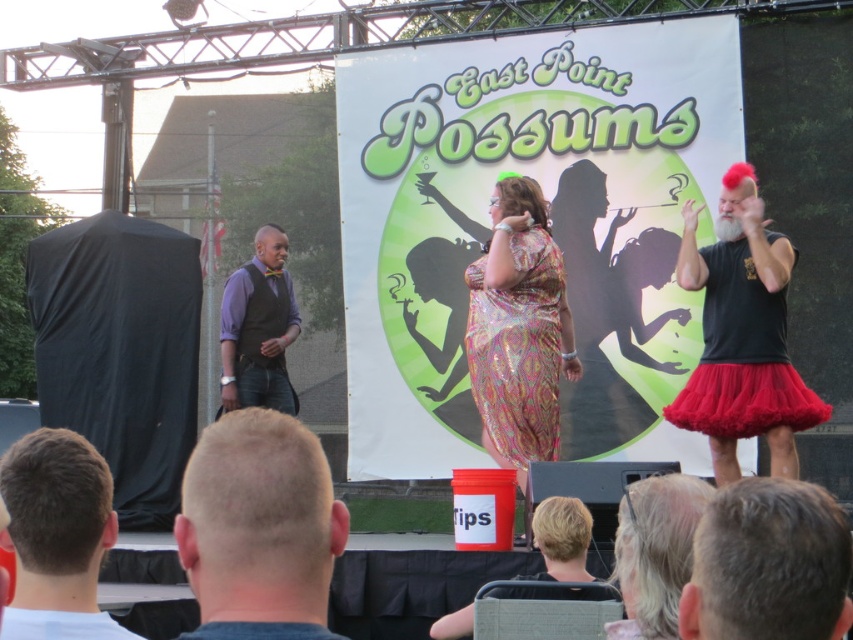
Which is more to the right, matte black tutu at right or black fabric shirt at lower center?

matte black tutu at right is more to the right.

Can you confirm if matte black tutu at right is thinner than black fabric shirt at lower center?

Yes.

Does point (798, 416) come behind point (573, 548)?

Yes.

This screenshot has height=640, width=853. I want to click on matte black tutu at right, so click(741, 333).

Measure the distance from matte black tutu at right to short hair at center.

They are 17.11 meters apart.

Does matte black tutu at right appear on the right side of short hair at center?

Indeed, matte black tutu at right is positioned on the right side of short hair at center.

At what (x,y) coordinates should I click in order to perform the action: click on matte black tutu at right. Please return your answer as a coordinate pair (x, y). The width and height of the screenshot is (853, 640). Looking at the image, I should click on (741, 333).

This screenshot has width=853, height=640. Find the location of `matte black tutu at right`. matte black tutu at right is located at coordinates (741, 333).

Measure the distance between short hair at center and camera.

short hair at center is 27.73 meters away from camera.

Does short hair at center appear over brown hair at center?

Actually, short hair at center is below brown hair at center.

Between point (773, 586) and point (45, 534), which one is positioned in front?

Point (773, 586)

Locate an element on the screen. This screenshot has width=853, height=640. short hair at center is located at coordinates (769, 564).